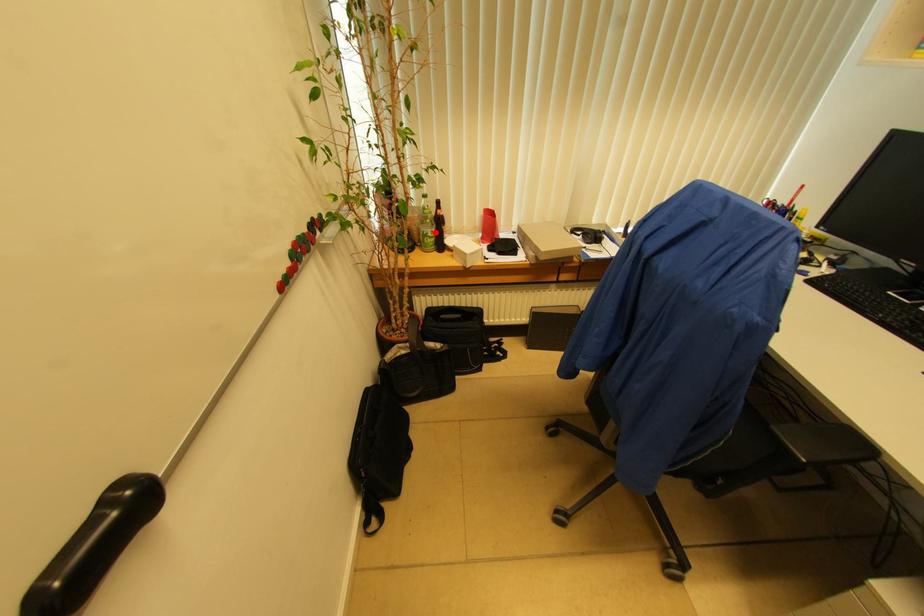
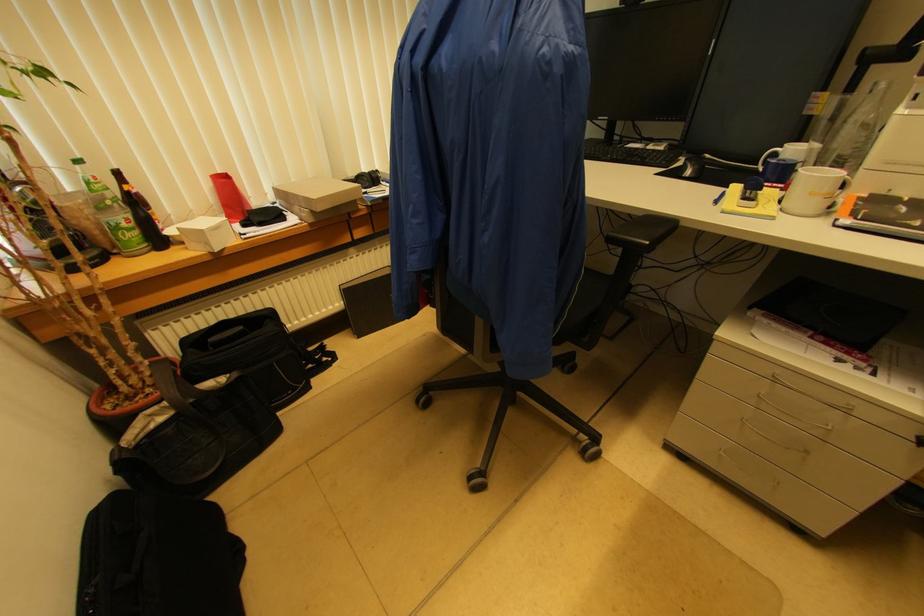
Question: I am providing you with two images of the same scene from different viewpoints. Image1 has a red point marked. In image2, the corresponding 3D location appears at what relative position? Reply with the corresponding letter.

Choices:
 (A) Closer
 (B) Farther

Answer: (B)